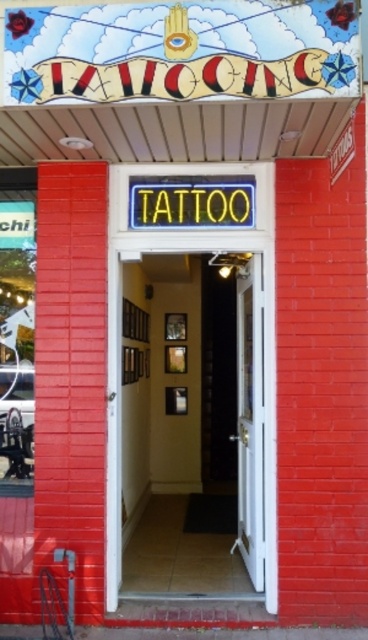
Question: Is white glossy door at center to the left of white wooden door at center from the viewer's perspective?

Choices:
 (A) no
 (B) yes

Answer: (B)

Question: Can you confirm if white glossy door at center is positioned to the right of white wooden door at center?

Choices:
 (A) yes
 (B) no

Answer: (B)

Question: Which point is farther from the camera taking this photo?

Choices:
 (A) (238, 548)
 (B) (189, 378)

Answer: (B)

Question: Observing the image, what is the correct spatial positioning of white glossy door at center in reference to white wooden door at center?

Choices:
 (A) above
 (B) below

Answer: (B)

Question: Which point is farther to the camera?

Choices:
 (A) white wooden door at center
 (B) white glossy door at center

Answer: (B)